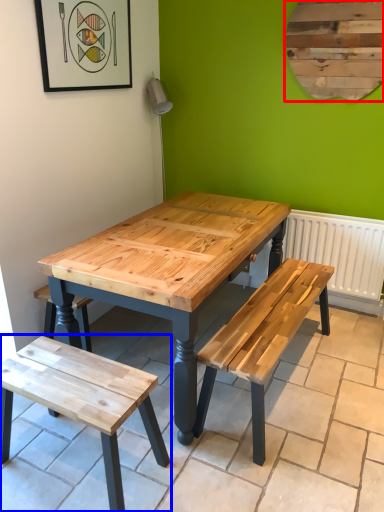
Question: Which object is closer to the camera taking this photo, bulletin board (highlighted by a red box) or bench (highlighted by a blue box)?

Choices:
 (A) bulletin board
 (B) bench

Answer: (B)